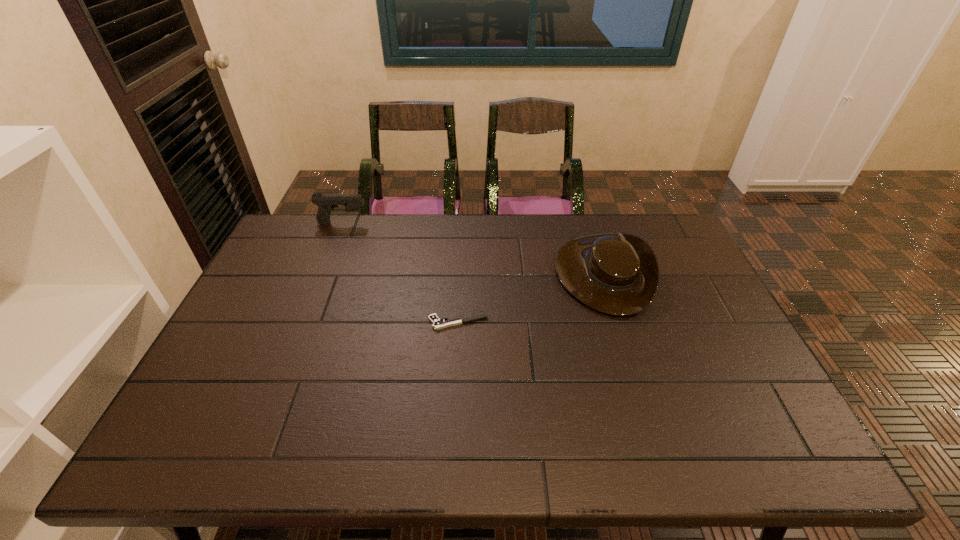
Find the location of a particular element. empty space between the right pistol and the leftmost object is located at coordinates (400, 273).

At what (x,y) coordinates should I click in order to perform the action: click on vacant region between the nearer pistol and the rightmost object. Please return your answer as a coordinate pair (x, y). The width and height of the screenshot is (960, 540). Looking at the image, I should click on (530, 298).

Find the location of a particular element. The width and height of the screenshot is (960, 540). free area in between the rightmost object and the taller pistol is located at coordinates (472, 248).

This screenshot has height=540, width=960. What are the coordinates of `blank region between the second object from right to left and the leftmost object` in the screenshot? It's located at (400, 273).

This screenshot has height=540, width=960. Identify the location of free space between the second object from right to left and the rightmost object. (530, 298).

What are the coordinates of `free space between the second tallest object and the second object from right to left` in the screenshot? It's located at (530, 298).

At what (x,y) coordinates should I click in order to perform the action: click on blank region between the second tallest object and the left pistol. Please return your answer as a coordinate pair (x, y). This screenshot has height=540, width=960. Looking at the image, I should click on (472, 248).

Locate an element on the screen. This screenshot has height=540, width=960. free space between the second tallest object and the left pistol is located at coordinates (472, 248).

Where is `vacant area that lies between the rightmost object and the shortest object`? Image resolution: width=960 pixels, height=540 pixels. vacant area that lies between the rightmost object and the shortest object is located at coordinates (530, 298).

Locate an element on the screen. The width and height of the screenshot is (960, 540). vacant area that lies between the second shortest object and the leftmost object is located at coordinates (472, 248).